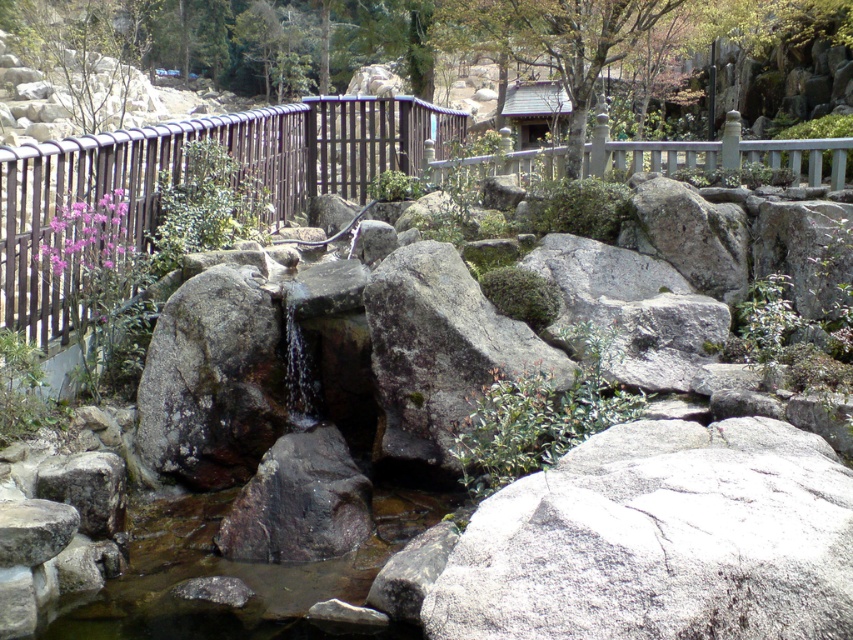
You are a hiker who wants to cross the stream safely. The green mossy rock at center and the dark gray rough rock at center are in your path. Which rock should you step on first to get closer to the other side?

You should step on the green mossy rock at center first because it is closer to you than the dark gray rough rock at center, allowing you to progress towards the other side more effectively.

You are standing at the point marked by the coordinate point at point (x=728, y=465). You want to cross the stream to the other side. The stream is 14.22 feet wide at this point. Can you safely cross it if your maximum safe crossing distance is 12 feet?

The stream is 14.22 feet wide at the point marked by the coordinate point at point (x=728, y=465), which exceeds your maximum safe crossing distance of 12 feet. Therefore, it is not safe to cross here.